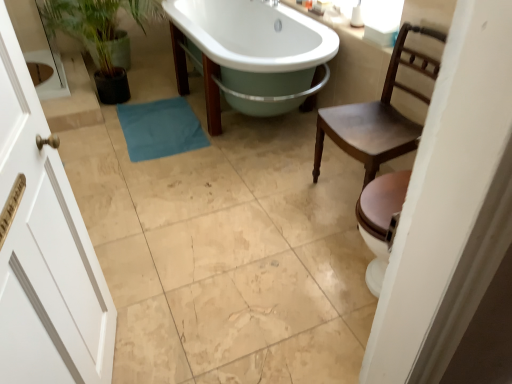
Measure the distance between white glossy bathtub at center and camera.

white glossy bathtub at center and camera are 2.20 meters apart.

Describe the element at coordinates (250, 36) in the screenshot. I see `white glossy bathtub at center` at that location.

This screenshot has height=384, width=512. What do you see at coordinates (160, 128) in the screenshot?
I see `blue fabric bath towel at center` at bounding box center [160, 128].

Where is `blue fabric bath towel at center`? Image resolution: width=512 pixels, height=384 pixels. blue fabric bath towel at center is located at coordinates (160, 128).

Find the location of a particular element. green matte plant at left is located at coordinates (98, 24).

The image size is (512, 384). Describe the element at coordinates (98, 24) in the screenshot. I see `green matte plant at left` at that location.

Measure the distance between brown wooden chair at right and camera.

brown wooden chair at right is 5.64 feet from camera.

This screenshot has height=384, width=512. Identify the location of white glossy bathtub at center. (250, 36).

Which object is further away from the camera taking this photo, blue fabric bath towel at center or green matte plant at left?

Positioned behind is blue fabric bath towel at center.

Between blue fabric bath towel at center and green matte plant at left, which one appears on the right side from the viewer's perspective?

blue fabric bath towel at center is more to the right.

Looking at their sizes, would you say blue fabric bath towel at center is wider or thinner than green matte plant at left?

In the image, blue fabric bath towel at center appears to be more narrow than green matte plant at left.

From the image's perspective, is blue fabric bath towel at center positioned above or below green matte plant at left?

blue fabric bath towel at center is situated lower than green matte plant at left in the image.

Locate an element on the screen. plant on the left of brown wooden chair at right is located at coordinates [98, 24].

Is brown wooden chair at right not close to green matte plant at left?

Indeed, brown wooden chair at right is not near green matte plant at left.

Is point (419, 128) positioned in front of point (132, 8)?

Yes.

What's the angular difference between brown wooden chair at right and white glossy bathtub at center's facing directions?

8.28e-05 degrees.

Does brown wooden chair at right contain white glossy bathtub at center?

That's incorrect, white glossy bathtub at center is not inside brown wooden chair at right.

From the image's perspective, is brown wooden chair at right above or below white glossy bathtub at center?

Based on their image positions, brown wooden chair at right is located beneath white glossy bathtub at center.

Does brown wooden chair at right have a smaller size compared to white glossy bathtub at center?

Correct, brown wooden chair at right occupies less space than white glossy bathtub at center.

Image resolution: width=512 pixels, height=384 pixels. I want to click on bath towel below the white glossy bathtub at center (from the image's perspective), so click(x=160, y=128).

Which of these two, white glossy bathtub at center or blue fabric bath towel at center, stands taller?

white glossy bathtub at center.

Is white glossy bathtub at center facing away from blue fabric bath towel at center?

white glossy bathtub at center is not turned away from blue fabric bath towel at center.

Is point (97, 23) more distant than point (141, 147)?

Yes, point (97, 23) is farther from viewer.

Choose the correct answer: Is green matte plant at left inside blue fabric bath towel at center or outside it?

green matte plant at left is outside blue fabric bath towel at center.

Can you confirm if green matte plant at left is thinner than blue fabric bath towel at center?

In fact, green matte plant at left might be wider than blue fabric bath towel at center.

From the image's perspective, which is above, blue fabric bath towel at center or white glossy bathtub at center?

From the image's view, white glossy bathtub at center is above.

Is blue fabric bath towel at center to the left of white glossy bathtub at center from the viewer's perspective?

Yes.

Which of these two, blue fabric bath towel at center or white glossy bathtub at center, is thinner?

blue fabric bath towel at center.

Would you say blue fabric bath towel at center is a long distance from white glossy bathtub at center?

Actually, blue fabric bath towel at center and white glossy bathtub at center are a little close together.

Could brown wooden chair at right be considered to be inside blue fabric bath towel at center?

No, brown wooden chair at right is located outside of blue fabric bath towel at center.

In the image, is blue fabric bath towel at center on the left side or the right side of brown wooden chair at right?

blue fabric bath towel at center is positioned on brown wooden chair at right's left side.

Is blue fabric bath towel at center in front of or behind brown wooden chair at right in the image?

Visually, blue fabric bath towel at center is located behind brown wooden chair at right.

Identify the location of bath towel directly beneath the green matte plant at left (from a real-world perspective). (160, 128).

Locate an element on the screen. The width and height of the screenshot is (512, 384). chair in front of the green matte plant at left is located at coordinates (378, 115).

From the image, which object appears to be farther from blue fabric bath towel at center, green matte plant at left or white glossy bathtub at center?

green matte plant at left lies further to blue fabric bath towel at center than the other object.

Considering their positions, is white glossy bathtub at center positioned further to green matte plant at left than blue fabric bath towel at center?

white glossy bathtub at center lies further to green matte plant at left than the other object.

Which object lies further to the anchor point blue fabric bath towel at center, green matte plant at left or brown wooden chair at right?

brown wooden chair at right.

From the image, which object appears to be nearer to white glossy bathtub at center, brown wooden chair at right or blue fabric bath towel at center?

blue fabric bath towel at center lies closer to white glossy bathtub at center than the other object.

Considering their positions, is blue fabric bath towel at center positioned further to green matte plant at left than white glossy bathtub at center?

white glossy bathtub at center is positioned further to the anchor green matte plant at left.

Estimate the real-world distances between objects in this image. Which object is closer to green matte plant at left, brown wooden chair at right or white glossy bathtub at center?

Among the two, white glossy bathtub at center is located nearer to green matte plant at left.

Considering their positions, is white glossy bathtub at center positioned closer to green matte plant at left than brown wooden chair at right?

The object closer to green matte plant at left is white glossy bathtub at center.

Considering their positions, is green matte plant at left positioned closer to white glossy bathtub at center than brown wooden chair at right?

The object closer to white glossy bathtub at center is green matte plant at left.

This screenshot has height=384, width=512. I want to click on bathtub between green matte plant at left and brown wooden chair at right from left to right, so click(250, 36).

Identify the location of bathtub between blue fabric bath towel at center and brown wooden chair at right from left to right. The height and width of the screenshot is (384, 512). (250, 36).

This screenshot has height=384, width=512. I want to click on bath towel between green matte plant at left and white glossy bathtub at center from left to right, so click(160, 128).

Where is `bath towel located between green matte plant at left and brown wooden chair at right in the left-right direction`? bath towel located between green matte plant at left and brown wooden chair at right in the left-right direction is located at coordinates [x=160, y=128].